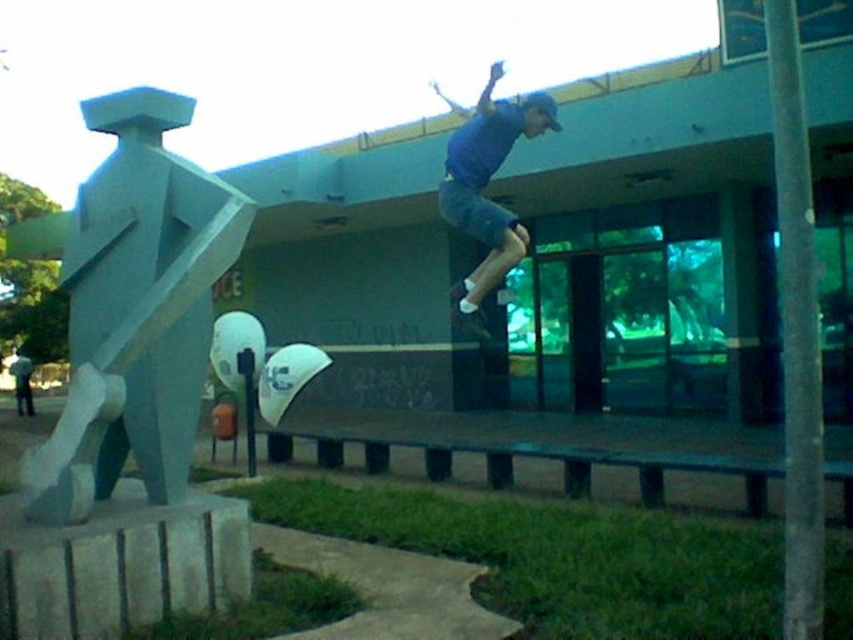
You are a photographer trying to capture the skateboarder and the statue in a single shot. Given that your camera can only focus on objects within a 3 meter width, will both the light blue stone statue at left and the white rubber skateboard at center fit in the frame?

The light blue stone statue at left is wider than the white rubber skateboard at center. Since the statue is wider, its width alone exceeds the 3 meter limit, so both objects might not fit within the frame.

You are a photographer positioned to the right of the skateboarder. You want to capture a shot that includes both the light blue stone statue at left and the blue matte skateboard at upper center in the same frame. Which direction should you move to ensure both are visible?

You should move to the right to ensure both the light blue stone statue at left and the blue matte skateboard at upper center are visible in the frame.